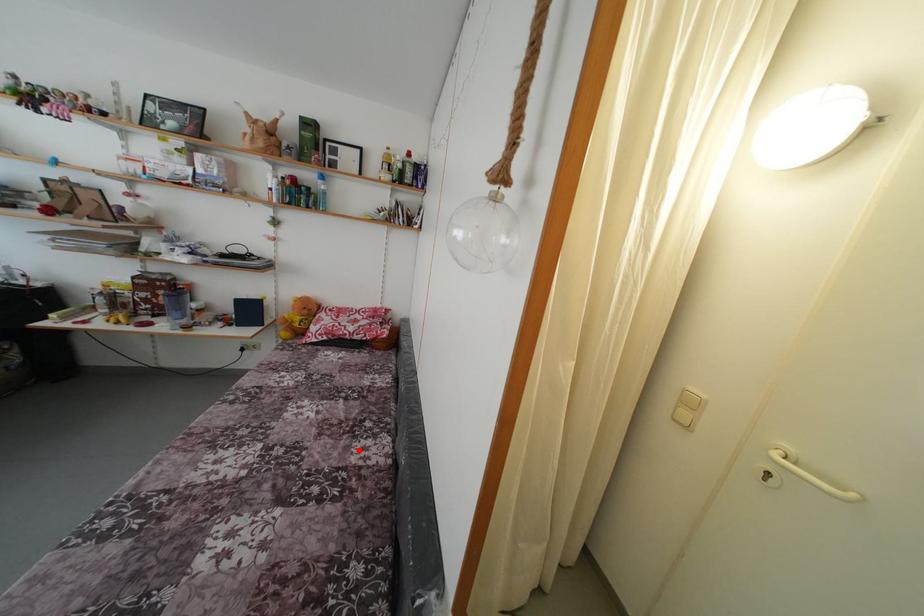
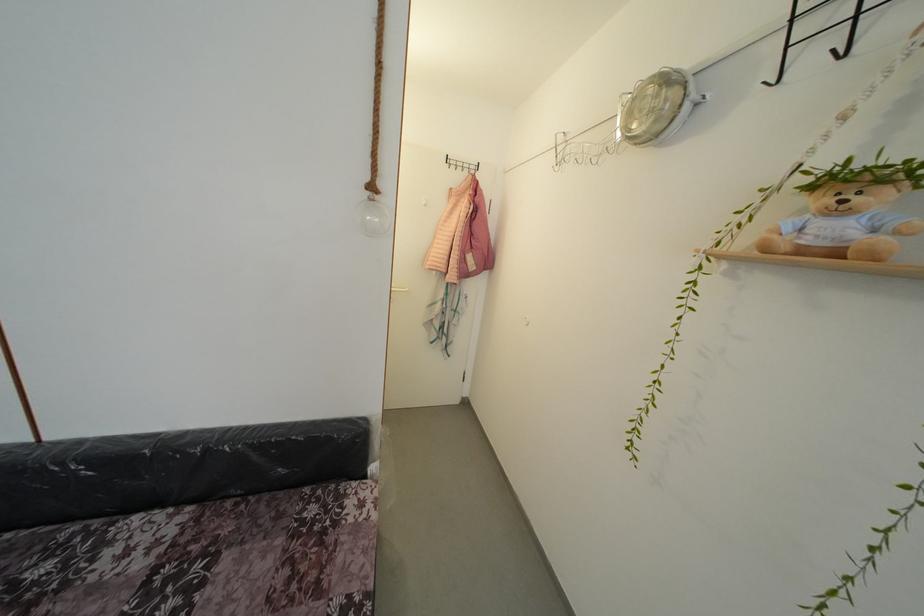
Where in the second image is the point corresponding to the highlighted location from the first image?

(99, 585)